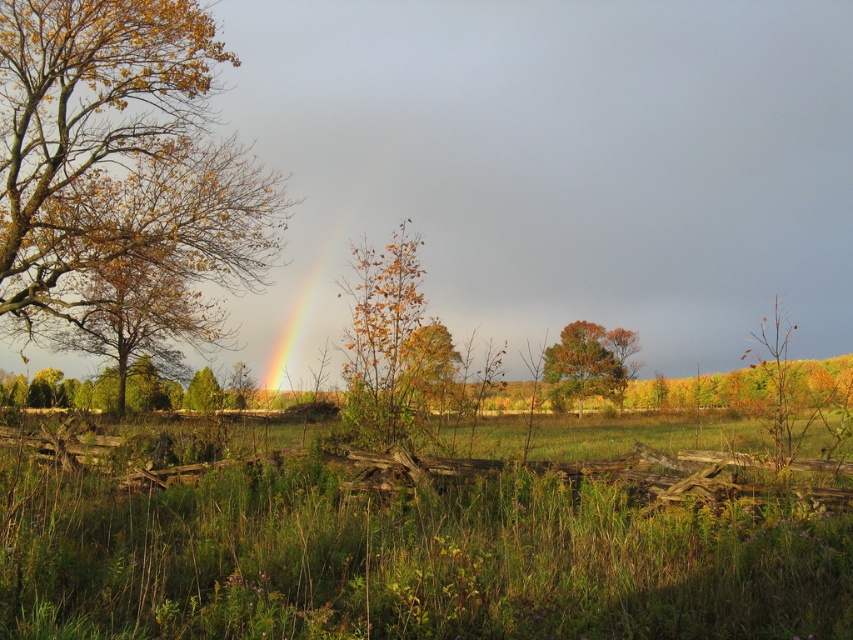
Who is positioned more to the left, green grass at center or golden-brown bark tree at left?

golden-brown bark tree at left is more to the left.

Can you confirm if green grass at center is thinner than golden-brown bark tree at left?

Yes, green grass at center is thinner than golden-brown bark tree at left.

Which is in front, point (393, 600) or point (103, 141)?

Point (393, 600) is more forward.

Locate an element on the screen. green grass at center is located at coordinates (404, 560).

Does green grass at center appear under orange-brown foliage at center?

Correct, green grass at center is located below orange-brown foliage at center.

Between green grass at center and orange-brown foliage at center, which one appears on the left side from the viewer's perspective?

green grass at center is more to the left.

Between point (405, 554) and point (554, 381), which one is positioned behind?

The point (554, 381) is more distant.

Locate an element on the screen. green grass at center is located at coordinates (404, 560).

Does point (328, 186) lie in front of point (612, 371)?

That is True.

Does rainbow at center have a lesser width compared to orange-brown foliage at center?

Yes.

Where is `rainbow at center`? The width and height of the screenshot is (853, 640). rainbow at center is located at coordinates (314, 307).